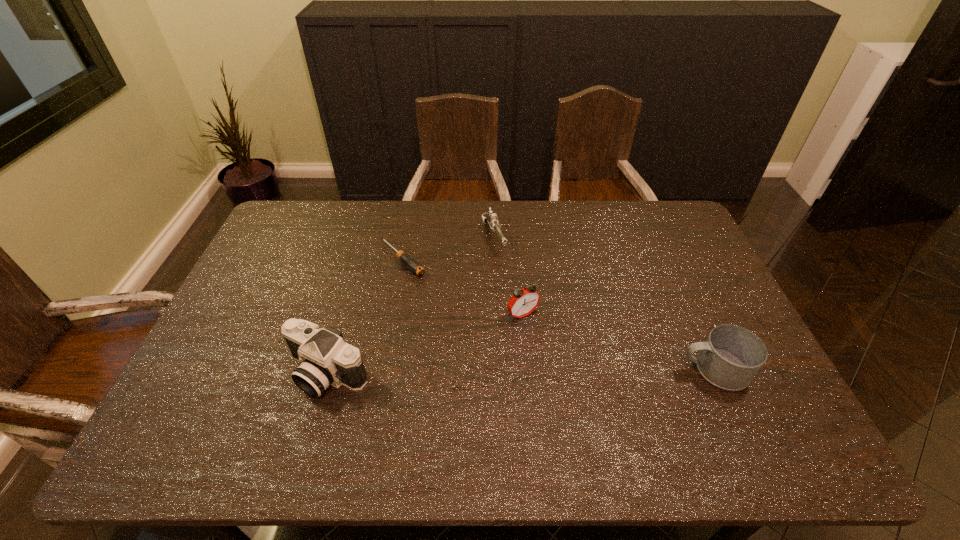
The height and width of the screenshot is (540, 960). Identify the location of vacant area situated at the tip of the shortest object. (429, 285).

Locate an element on the screen. The height and width of the screenshot is (540, 960). vacant space located 0.260m at the tip of the shortest object is located at coordinates (468, 320).

This screenshot has height=540, width=960. I want to click on vacant space located on the clock face of the alarm clock, so click(548, 345).

The width and height of the screenshot is (960, 540). In order to click on vacant region located 0.170m on the clock face of the alarm clock in this screenshot , I will do `click(564, 367)`.

This screenshot has height=540, width=960. I want to click on vacant space situated 0.260m on the clock face of the alarm clock, so click(x=586, y=394).

Identify the location of vacant space located 0.300m aimed along the barrel of the gun. (530, 321).

The image size is (960, 540). In order to click on free spot located aimed along the barrel of the gun in this screenshot , I will do `click(520, 302)`.

The height and width of the screenshot is (540, 960). In order to click on blank space located aimed along the barrel of the gun in this screenshot , I will do `click(508, 275)`.

Find the location of a particular element. Image resolution: width=960 pixels, height=540 pixels. object situated at the far edge is located at coordinates [492, 219].

You are a GUI agent. You are given a task and a screenshot of the screen. Output one action in this format:
    pyautogui.click(x=<x>, y=<y>)
    Task: Click on the camera that is at the near edge
    The height and width of the screenshot is (540, 960).
    Given the screenshot: What is the action you would take?
    pyautogui.click(x=325, y=358)